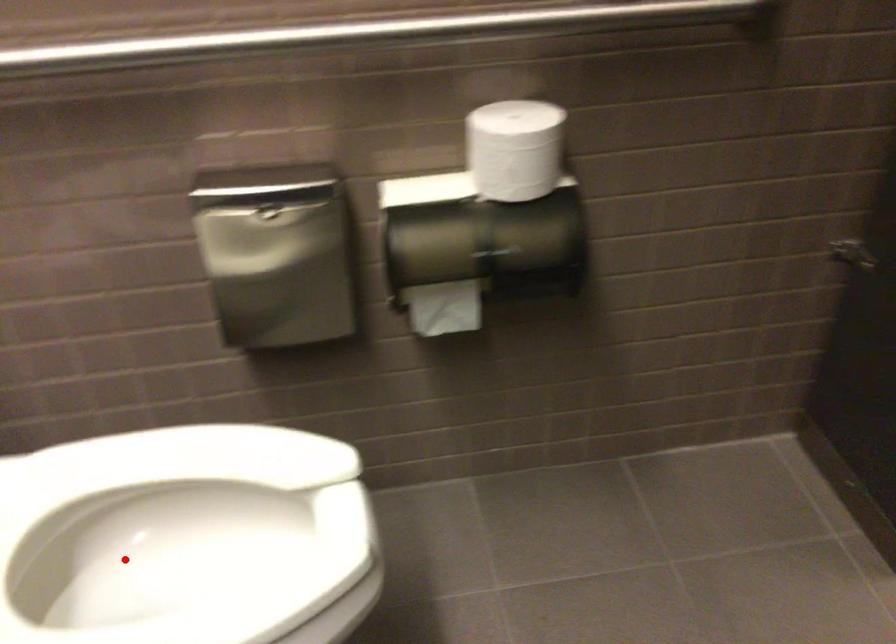
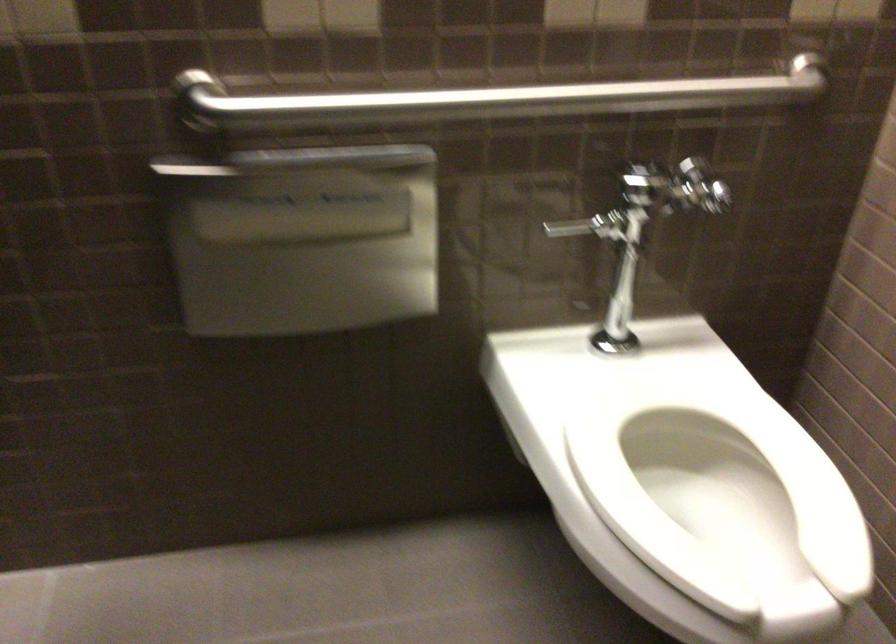
Question: I am providing you with two images of the same scene from different viewpoints. In image1, a red point is highlighted. Considering the same 3D point in image2, which of the following is correct?

Choices:
 (A) It is closer
 (B) It is farther

Answer: (B)